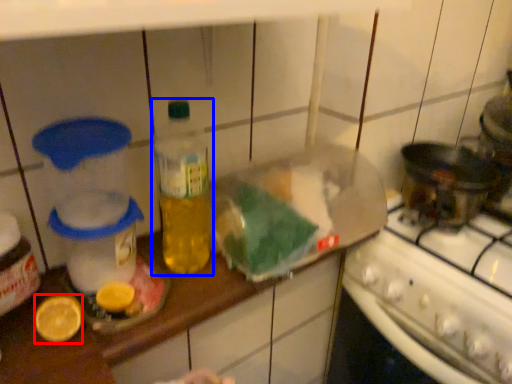
Question: Among these objects, which one is nearest to the camera, lemon (highlighted by a red box) or bottle (highlighted by a blue box)?

Choices:
 (A) lemon
 (B) bottle

Answer: (A)